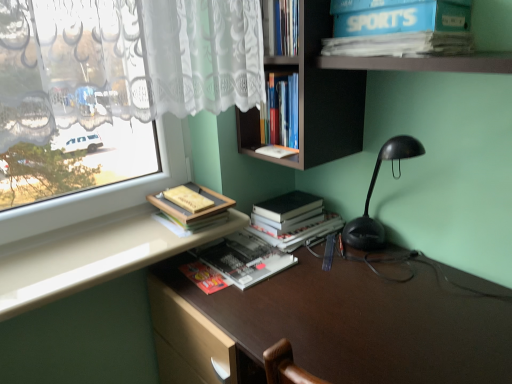
What is the approximate width of brown matte desk at center?

brown matte desk at center is 27.42 inches wide.

The height and width of the screenshot is (384, 512). I want to click on white glossy counter top at lower left, so click(x=91, y=256).

Where is `blue cardboard box at upper right`? blue cardboard box at upper right is located at coordinates (425, 63).

This screenshot has width=512, height=384. I want to click on matte yellow book at upper left, arranged as the 2th book when viewed from the top, so [x=195, y=212].

The width and height of the screenshot is (512, 384). What do you see at coordinates (195, 212) in the screenshot? I see `matte yellow book at upper left, arranged as the 2th book when viewed from the top` at bounding box center [195, 212].

Identify the location of brown matte desk at center. The width and height of the screenshot is (512, 384). (x=331, y=326).

Is the surface of matte yellow book at upper left, the third book in the bottom-to-top sequence, in direct contact with hardcover black book at center, positioned as the 3th book in top-to-bottom order?

matte yellow book at upper left, the third book in the bottom-to-top sequence, is not next to hardcover black book at center, positioned as the 3th book in top-to-bottom order, and they're not touching.

Considering the points (190, 187) and (317, 218), which point is behind, point (190, 187) or point (317, 218)?

Positioned behind is point (317, 218).

Between matte yellow book at upper left, arranged as the 2th book when viewed from the top, and hardcover black book at center, the 2th book from the bottom, which one has less height?

matte yellow book at upper left, arranged as the 2th book when viewed from the top, is shorter.

How different are the orientations of matte yellow book at upper left, arranged as the 2th book when viewed from the top, and hardcover black book at center, the 2th book from the bottom, in degrees?

89.2 degrees separate the facing orientations of matte yellow book at upper left, arranged as the 2th book when viewed from the top, and hardcover black book at center, the 2th book from the bottom.

From the picture: Can you confirm if blue cardboard box at upper right is bigger than matte yellow book at upper left, the third book in the bottom-to-top sequence?

Correct, blue cardboard box at upper right is larger in size than matte yellow book at upper left, the third book in the bottom-to-top sequence.

Could you tell me if blue cardboard box at upper right is turned towards matte yellow book at upper left, the third book in the bottom-to-top sequence?

No, blue cardboard box at upper right is not oriented towards matte yellow book at upper left, the third book in the bottom-to-top sequence.

Is blue cardboard box at upper right thinner than matte yellow book at upper left, the third book in the bottom-to-top sequence?

Indeed, blue cardboard box at upper right has a lesser width compared to matte yellow book at upper left, the third book in the bottom-to-top sequence.

The height and width of the screenshot is (384, 512). I want to click on shelf located above the matte yellow book at upper left, arranged as the 2th book when viewed from the top (from a real-world perspective), so click(425, 63).

Is point (298, 126) closer or farther from the camera than point (156, 261)?

Point (298, 126) is positioned farther from the camera compared to point (156, 261).

Is hardcover books at center, marked as the 4th book in a bottom-to-top arrangement, next to white glossy counter top at lower left?

No, hardcover books at center, marked as the 4th book in a bottom-to-top arrangement, is not making contact with white glossy counter top at lower left.

Is hardcover books at center, the 1th book when ordered from top to bottom, aimed at white glossy counter top at lower left?

Yes, hardcover books at center, the 1th book when ordered from top to bottom, is facing white glossy counter top at lower left.

Is hardcover books at center, the 1th book when ordered from top to bottom, positioned beyond the bounds of white glossy counter top at lower left?

hardcover books at center, the 1th book when ordered from top to bottom, is positioned outside white glossy counter top at lower left.

Relative to hardcover book at center, which appears as the 1th book when ordered from the bottom, is blue cardboard box at upper right in front or behind?

Clearly, blue cardboard box at upper right is in front of hardcover book at center, which appears as the 1th book when ordered from the bottom.

From a real-world perspective, is blue cardboard box at upper right under hardcover book at center, which appears as the 1th book when ordered from the bottom?

No, from a real-world perspective, blue cardboard box at upper right is not under hardcover book at center, which appears as the 1th book when ordered from the bottom.

Based on the photo, how many degrees apart are the facing directions of blue cardboard box at upper right and hardcover book at center, which appears as the 1th book when ordered from the bottom?

There is a 0.175-degree angle between the facing directions of blue cardboard box at upper right and hardcover book at center, which appears as the 1th book when ordered from the bottom.

Which is farther from the camera, [499,68] or [216,263]?

Point [216,263]

Considering the positions of objects hardcover book at center, marked as the fourth book in a top-to-bottom arrangement, and white glossy counter top at lower left in the image provided, who is more to the left, hardcover book at center, marked as the fourth book in a top-to-bottom arrangement, or white glossy counter top at lower left?

white glossy counter top at lower left.

Could white glossy counter top at lower left be considered to be inside hardcover book at center, marked as the fourth book in a top-to-bottom arrangement?

No, white glossy counter top at lower left is not inside hardcover book at center, marked as the fourth book in a top-to-bottom arrangement.

Who is taller, hardcover book at center, marked as the fourth book in a top-to-bottom arrangement, or white glossy counter top at lower left?

With more height is white glossy counter top at lower left.

In terms of width, does hardcover book at center, which appears as the 1th book when ordered from the bottom, look wider or thinner when compared to white glossy counter top at lower left?

hardcover book at center, which appears as the 1th book when ordered from the bottom, is thinner than white glossy counter top at lower left.

Does point (325, 56) come in front of point (339, 266)?

Yes, it is in front of point (339, 266).

Considering the relative sizes of blue cardboard box at upper right and brown matte desk at center in the image provided, is blue cardboard box at upper right wider than brown matte desk at center?

Incorrect, the width of blue cardboard box at upper right does not surpass that of brown matte desk at center.

Is blue cardboard box at upper right shorter than brown matte desk at center?

Yes, blue cardboard box at upper right is shorter than brown matte desk at center.

Between white glossy counter top at lower left and brown matte desk at center, which one has smaller size?

With smaller size is white glossy counter top at lower left.

Between white glossy counter top at lower left and brown matte desk at center, which one appears on the right side from the viewer's perspective?

From the viewer's perspective, brown matte desk at center appears more on the right side.

Which point is more forward, (173, 246) or (275, 305)?

Positioned in front is point (275, 305).

From a real-world perspective, which book is the 1st one underneath the matte yellow book at upper left, the third book in the bottom-to-top sequence? Please provide its 2D coordinates.

[(293, 220)]

You are a GUI agent. You are given a task and a screenshot of the screen. Output one action in this format:
    pyautogui.click(x=<x>, y=<y>)
    Task: Click on the 2nd book behind the blue cardboard box at upper right, counting from the anchor's position
    This screenshot has width=512, height=384.
    Given the screenshot: What is the action you would take?
    pyautogui.click(x=195, y=212)

Based on their spatial positions, is white glossy counter top at lower left or blue cardboard box at upper right further from hardcover books at center, the 1th book when ordered from top to bottom?

Among the two, white glossy counter top at lower left is located further to hardcover books at center, the 1th book when ordered from top to bottom.

Based on their spatial positions, is matte yellow book at upper left, arranged as the 2th book when viewed from the top, or hardcover black book at center, positioned as the 3th book in top-to-bottom order, closer to hardcover books at center, marked as the 4th book in a bottom-to-top arrangement?

hardcover black book at center, positioned as the 3th book in top-to-bottom order, lies closer to hardcover books at center, marked as the 4th book in a bottom-to-top arrangement, than the other object.

Considering their positions, is hardcover book at center, marked as the fourth book in a top-to-bottom arrangement, positioned further to white glossy counter top at lower left than matte yellow book at upper left, arranged as the 2th book when viewed from the top?

hardcover book at center, marked as the fourth book in a top-to-bottom arrangement, is further to white glossy counter top at lower left.

From the picture: Estimate the real-world distances between objects in this image. Which object is further from brown matte desk at center, hardcover black book at center, the 2th book from the bottom, or hardcover book at center, marked as the fourth book in a top-to-bottom arrangement?

hardcover black book at center, the 2th book from the bottom, is further to brown matte desk at center.

Considering their positions, is hardcover book at center, marked as the fourth book in a top-to-bottom arrangement, positioned closer to white glossy counter top at lower left than blue cardboard box at upper right?

Based on the image, hardcover book at center, marked as the fourth book in a top-to-bottom arrangement, appears to be nearer to white glossy counter top at lower left.

Based on their spatial positions, is brown matte desk at center or white glossy counter top at lower left further from hardcover black book at center, the 2th book from the bottom?

Based on the image, white glossy counter top at lower left appears to be further to hardcover black book at center, the 2th book from the bottom.

When comparing their distances from hardcover books at center, marked as the 4th book in a bottom-to-top arrangement, does matte yellow book at upper left, the third book in the bottom-to-top sequence, or hardcover book at center, marked as the fourth book in a top-to-bottom arrangement, seem further?

Among the two, hardcover book at center, marked as the fourth book in a top-to-bottom arrangement, is located further to hardcover books at center, marked as the 4th book in a bottom-to-top arrangement.

From the picture: Based on their spatial positions, is hardcover books at center, marked as the 4th book in a bottom-to-top arrangement, or matte yellow book at upper left, arranged as the 2th book when viewed from the top, closer to hardcover book at center, which appears as the 1th book when ordered from the bottom?

Based on the image, matte yellow book at upper left, arranged as the 2th book when viewed from the top, appears to be nearer to hardcover book at center, which appears as the 1th book when ordered from the bottom.

Where is `counter top located between brown matte desk at center and hardcover black book at center, the 2th book from the bottom, in the depth direction`? The height and width of the screenshot is (384, 512). counter top located between brown matte desk at center and hardcover black book at center, the 2th book from the bottom, in the depth direction is located at coordinates (91, 256).

Identify the location of book located between matte yellow book at upper left, the third book in the bottom-to-top sequence, and hardcover black book at center, the 2th book from the bottom, in the left-right direction. (245, 258).

Image resolution: width=512 pixels, height=384 pixels. I want to click on counter top between blue cardboard box at upper right and brown matte desk at center in the vertical direction, so click(x=91, y=256).

Image resolution: width=512 pixels, height=384 pixels. Identify the location of book between hardcover books at center, the 1th book when ordered from top to bottom, and hardcover black book at center, the 2th book from the bottom, in the vertical direction. (195, 212).